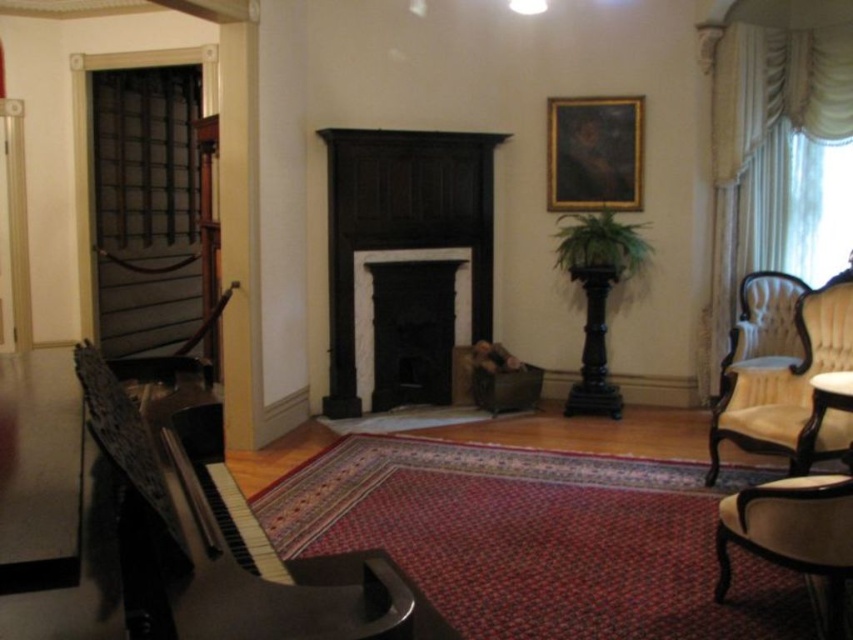
Question: Which of the following is the farthest from the observer?

Choices:
 (A) (433, 253)
 (B) (132, 433)
 (C) (345, 392)
 (D) (761, 310)

Answer: (A)

Question: Does velvet cream armchair at right appear under black matte fireplace at center?

Choices:
 (A) yes
 (B) no

Answer: (A)

Question: Among these points, which one is nearest to the camera?

Choices:
 (A) (12, 396)
 (B) (769, 284)

Answer: (A)

Question: Can you confirm if polished wood piano at left is smaller than black wood fireplace at center?

Choices:
 (A) yes
 (B) no

Answer: (A)

Question: Which point is closer to the camera?

Choices:
 (A) (795, 328)
 (B) (358, 225)
 (C) (131, 557)

Answer: (C)

Question: Does velvet cream armchair at right have a larger size compared to black matte fireplace at center?

Choices:
 (A) yes
 (B) no

Answer: (A)